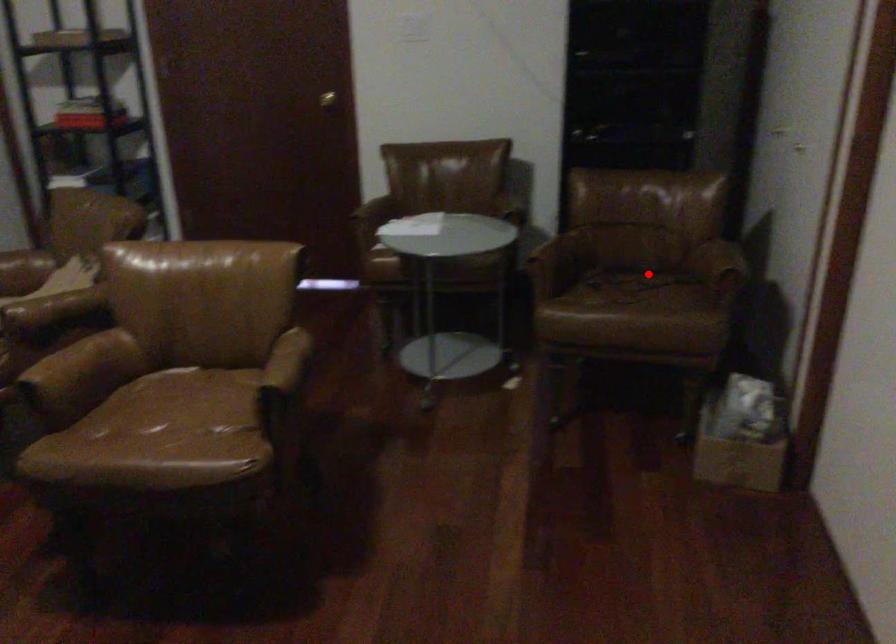
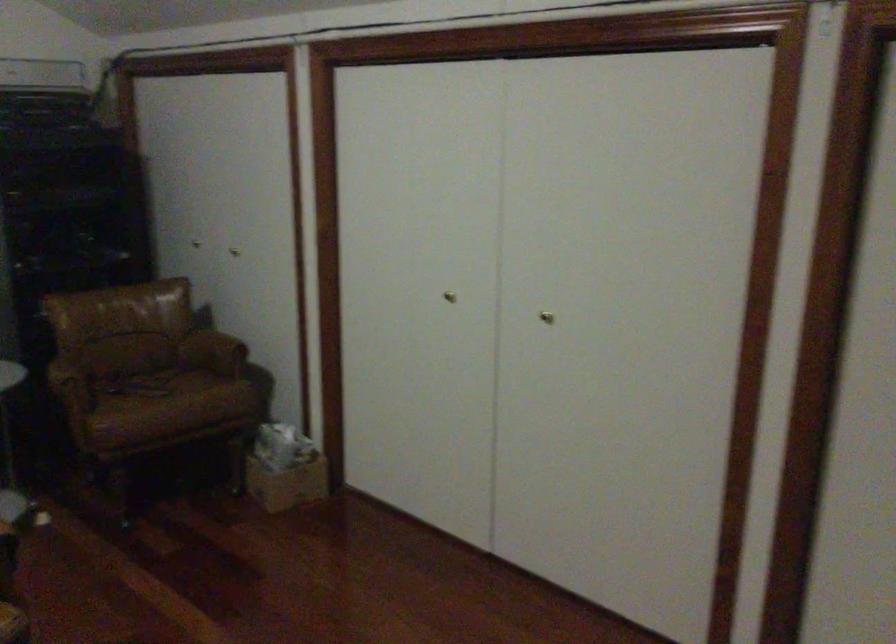
Question: I am providing you with two images of the same scene from different viewpoints. Given a red point in image1, look at the same physical point in image2. Is it:

Choices:
 (A) Closer to the viewpoint
 (B) Farther from the viewpoint

Answer: (B)